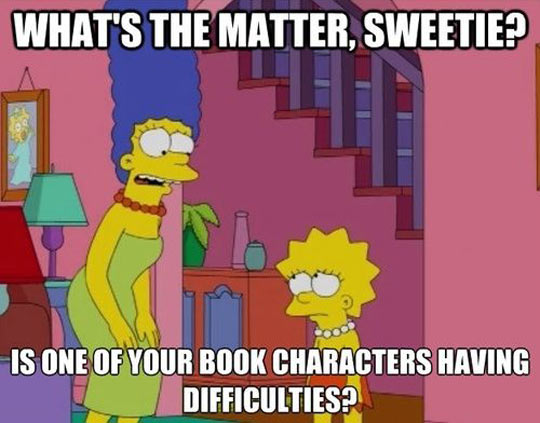
Locate an element on the screen. window is located at coordinates (221, 318).